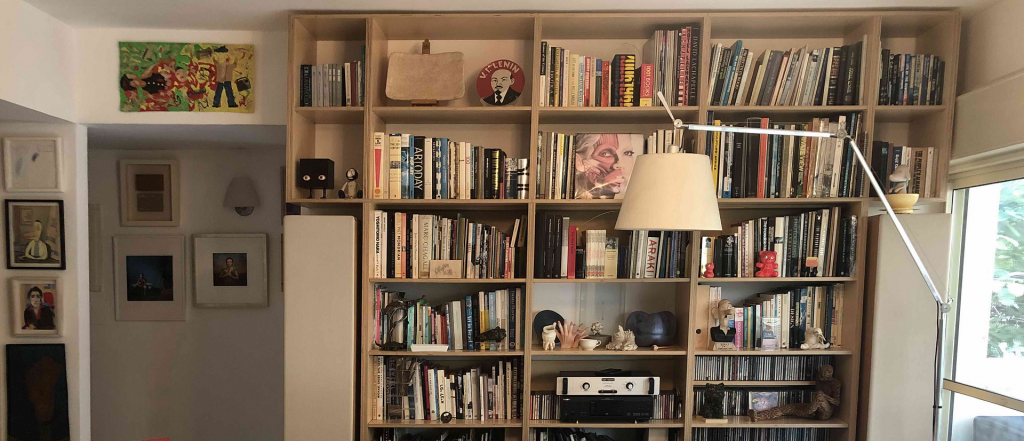
What are the coordinates of `stereo` in the screenshot? It's located at (603, 381).